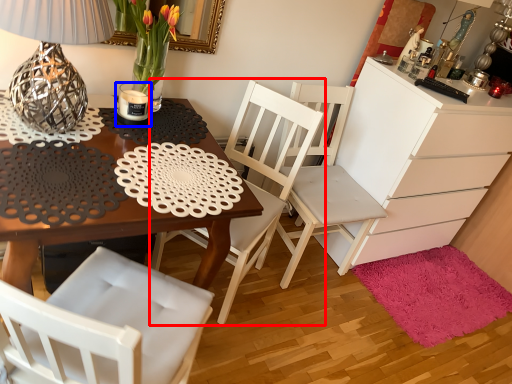
Question: Which point is further to the camera, chair (highlighted by a red box) or candle holder (highlighted by a blue box)?

Choices:
 (A) chair
 (B) candle holder

Answer: (B)